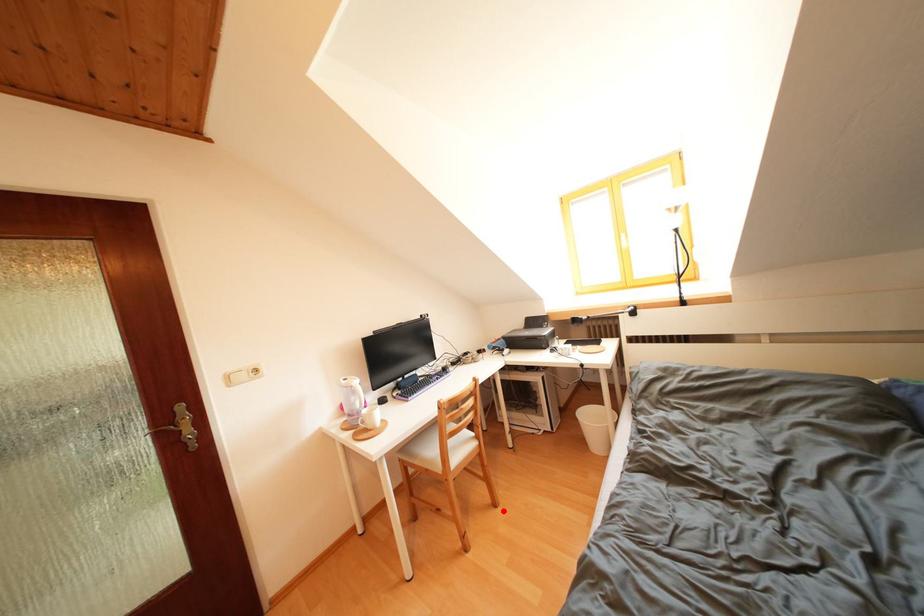
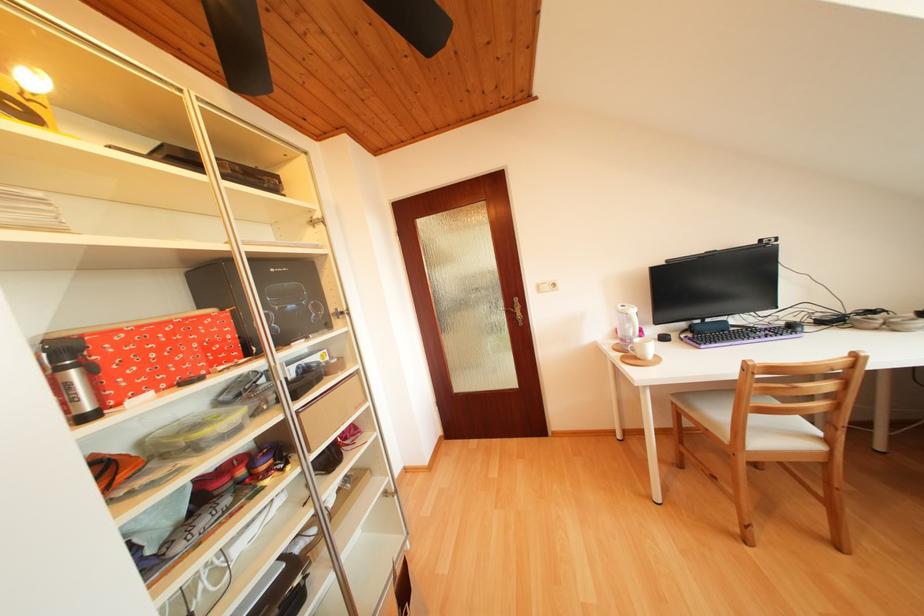
Question: A red point is marked in image1. In image2, is the corresponding 3D point closer to the camera or farther? Reply with the corresponding letter.

Choices:
 (A) The corresponding 3D point is closer.
 (B) The corresponding 3D point is farther.

Answer: (B)